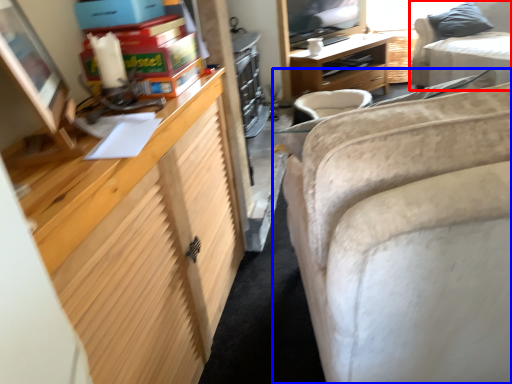
Question: Which point is further to the camera, studio couch (highlighted by a red box) or studio couch (highlighted by a blue box)?

Choices:
 (A) studio couch
 (B) studio couch

Answer: (A)